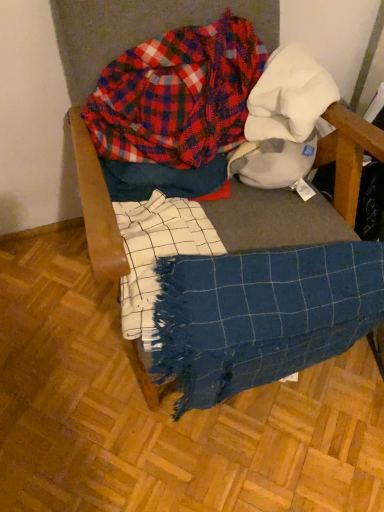
Question: Do you think blue woven blanket at center is within plaid flannel shirt at upper center, or outside of it?

Choices:
 (A) inside
 (B) outside

Answer: (B)

Question: Considering the positions of point (326, 151) and point (134, 113), is point (326, 151) closer or farther from the camera than point (134, 113)?

Choices:
 (A) closer
 (B) farther

Answer: (A)

Question: Which of these objects is positioned closest to the blue woven blanket at lower right?

Choices:
 (A) blue woven blanket at center
 (B) plaid flannel shirt at upper center

Answer: (A)

Question: Which is farther from the blue woven blanket at lower right?

Choices:
 (A) blue woven blanket at center
 (B) plaid flannel shirt at upper center

Answer: (B)